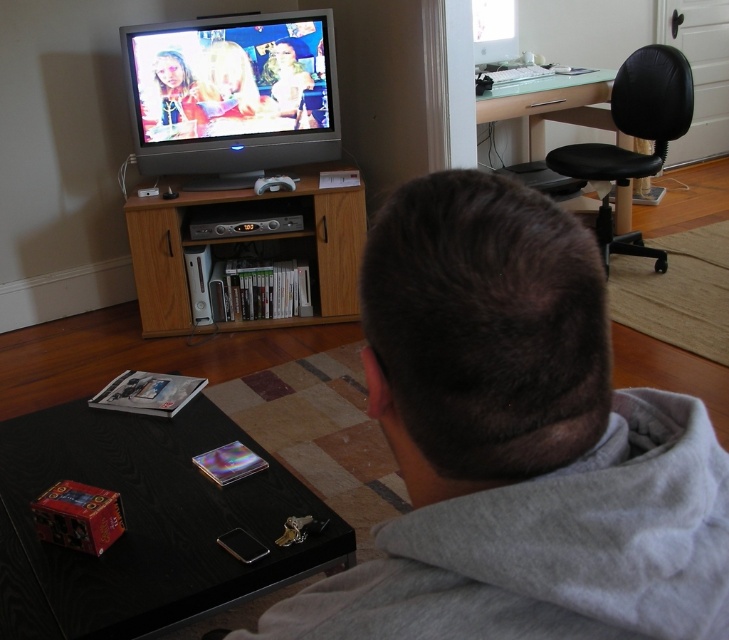
How distant is gray cotton hoodie at upper center from wooden entertainment center at center?

The distance of gray cotton hoodie at upper center from wooden entertainment center at center is 8.99 feet.

Which is below, gray cotton hoodie at upper center or wooden entertainment center at center?

gray cotton hoodie at upper center is lower down.

Where is `gray cotton hoodie at upper center`? The height and width of the screenshot is (640, 729). gray cotton hoodie at upper center is located at coordinates (518, 442).

Who is positioned more to the right, wooden entertainment center at center or black leather swivel chair at upper right?

black leather swivel chair at upper right

Consider the image. Who is more forward, (278, 237) or (655, 269)?

Point (278, 237)

The image size is (729, 640). I want to click on wooden entertainment center at center, so coord(249,252).

Can you confirm if gray cotton hoodie at upper center is positioned to the right of black leather swivel chair at upper right?

No, gray cotton hoodie at upper center is not to the right of black leather swivel chair at upper right.

Who is positioned more to the left, gray cotton hoodie at upper center or black leather swivel chair at upper right?

gray cotton hoodie at upper center

Which is in front, point (518, 228) or point (671, 54)?

Point (518, 228) is in front.

At what (x,y) coordinates should I click in order to perform the action: click on gray cotton hoodie at upper center. Please return your answer as a coordinate pair (x, y). Looking at the image, I should click on (518, 442).